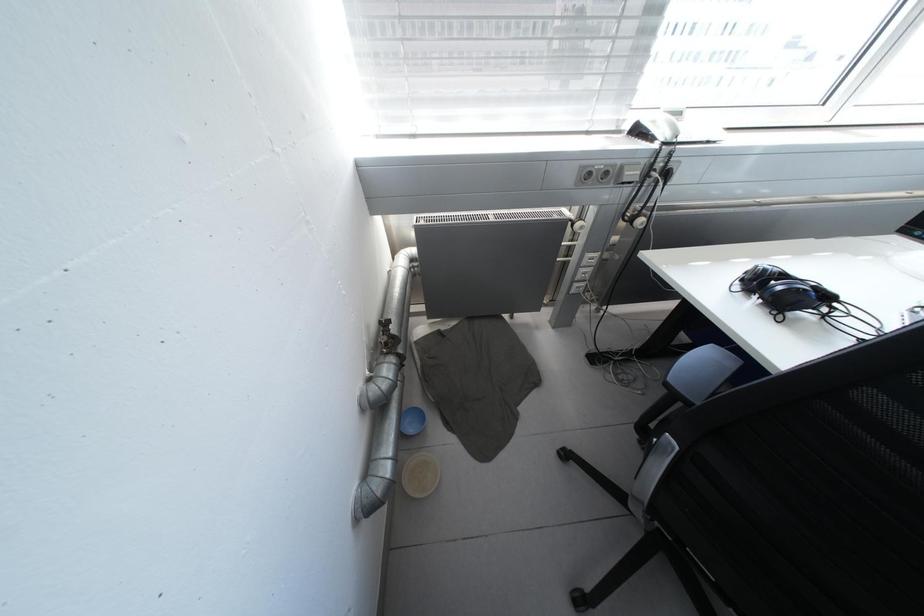
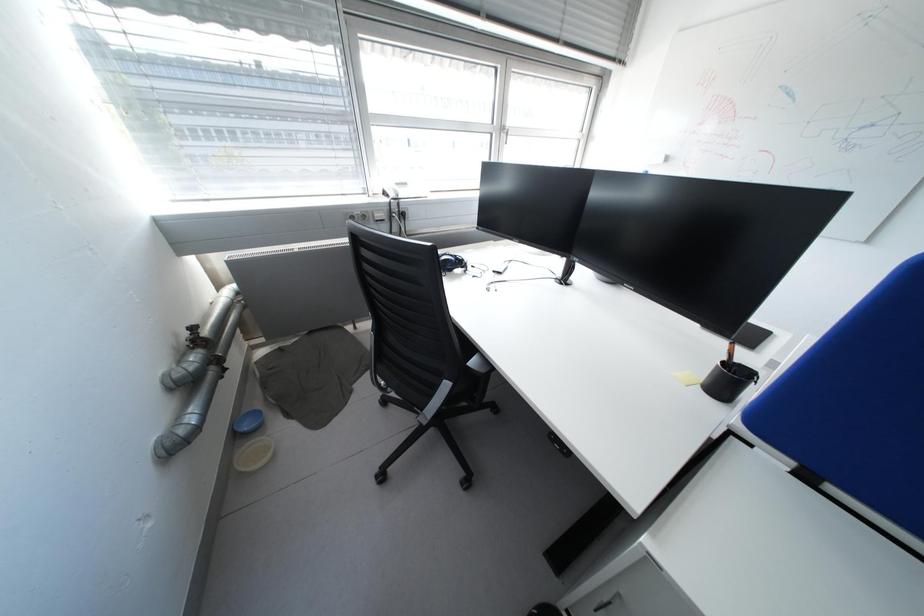
Question: The camera is either moving clockwise (left) or counter-clockwise (right) around the object. The first image is from the beginning of the video and the second image is from the end. Is the camera moving left or right when shooting the video?

Choices:
 (A) Left
 (B) Right

Answer: (A)